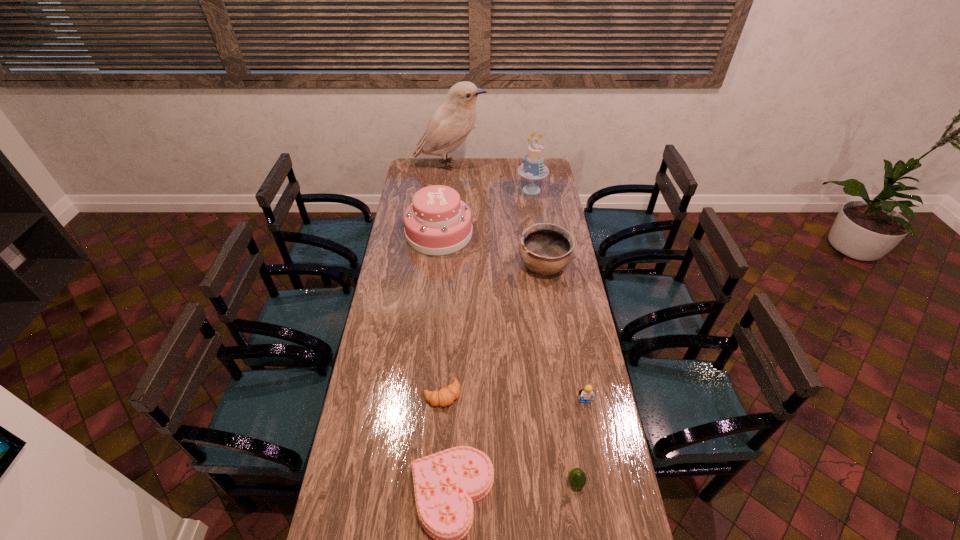
I want to click on free space located on the face of the farthest object, so click(516, 165).

Find the location of `vacant region located with a ladder on the side of the farthest cake`. vacant region located with a ladder on the side of the farthest cake is located at coordinates (539, 235).

Identify the location of free location located 0.070m on the front of the second shortest cake. The width and height of the screenshot is (960, 540). (436, 266).

I want to click on vacant space located 0.230m on the back of the pottery, so click(x=538, y=220).

The height and width of the screenshot is (540, 960). I want to click on free region located on the front-facing side of the Lego, so click(594, 453).

Locate an element on the screen. Image resolution: width=960 pixels, height=540 pixels. vacant space located 0.110m on the front of the avocado is located at coordinates (583, 532).

You are a GUI agent. You are given a task and a screenshot of the screen. Output one action in this format:
    pyautogui.click(x=<x>, y=<y>)
    Task: Click on the free spot located on the front of the crescent roll
    The image size is (960, 540).
    Given the screenshot: What is the action you would take?
    pyautogui.click(x=440, y=426)

Where is `object present at the far edge`? The width and height of the screenshot is (960, 540). object present at the far edge is located at coordinates (450, 124).

Locate an element on the screen. Image resolution: width=960 pixels, height=540 pixels. parakeet that is positioned at the left edge is located at coordinates (450, 124).

I want to click on cake that is at the left edge, so click(437, 222).